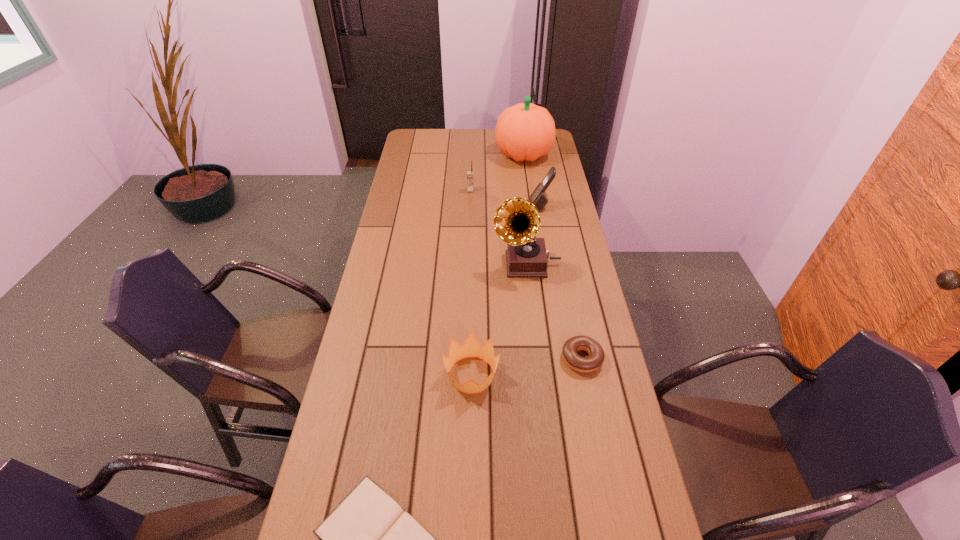
Locate an element on the screen. Image resolution: width=960 pixels, height=540 pixels. vacant space that satisfies the following two spatial constraints: 1. from the horn of the phonograph record; 2. on the left side of the doughnut is located at coordinates (537, 359).